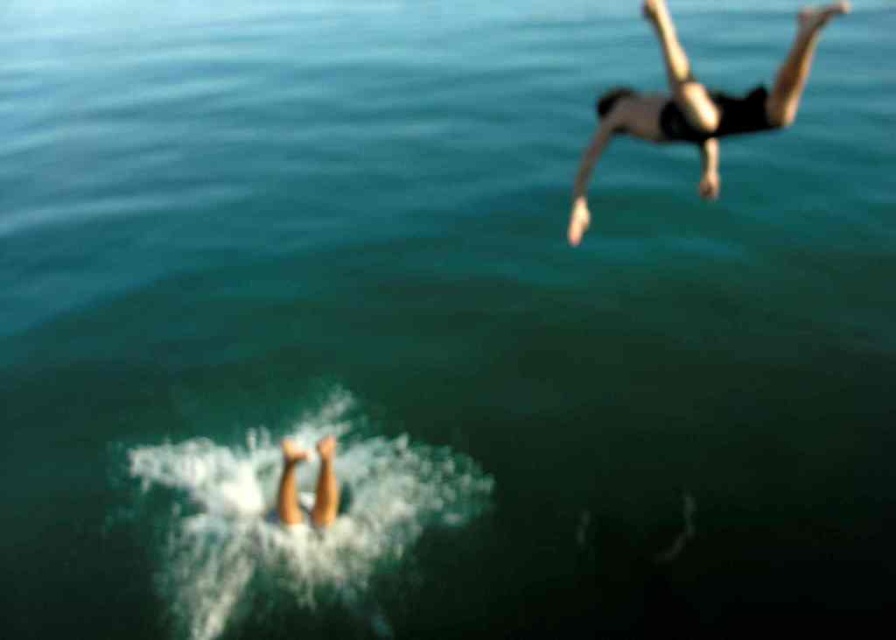
Locate an element on the screen. The width and height of the screenshot is (896, 640). black matte diver at upper right is located at coordinates (696, 104).

Measure the distance between black matte diver at upper right and camera.

black matte diver at upper right is 10.05 meters from camera.

Locate an element on the screen. This screenshot has height=640, width=896. black matte diver at upper right is located at coordinates (696, 104).

This screenshot has height=640, width=896. What are the coordinates of `black matte diver at upper right` in the screenshot? It's located at (696, 104).